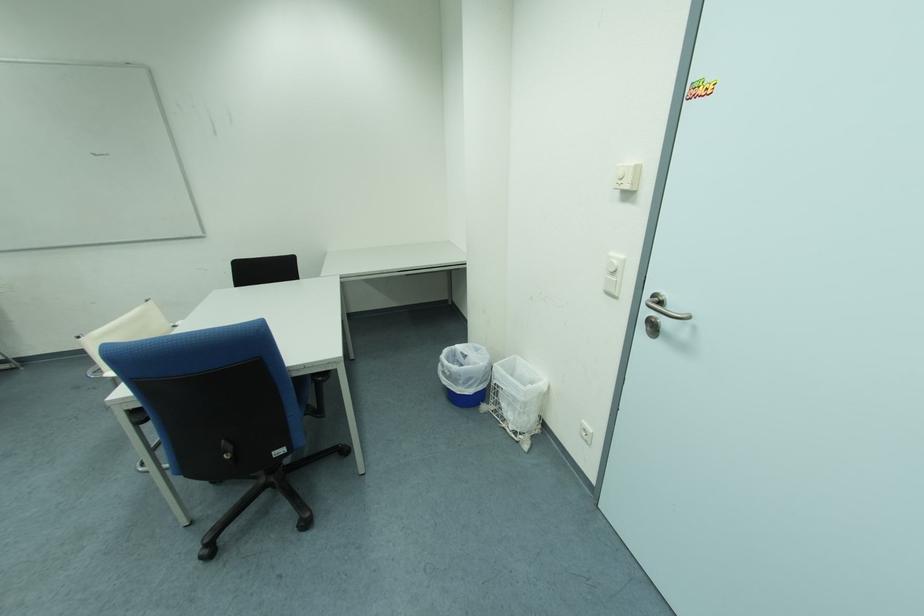
In order to click on white light switch in this screenshot , I will do `click(613, 274)`.